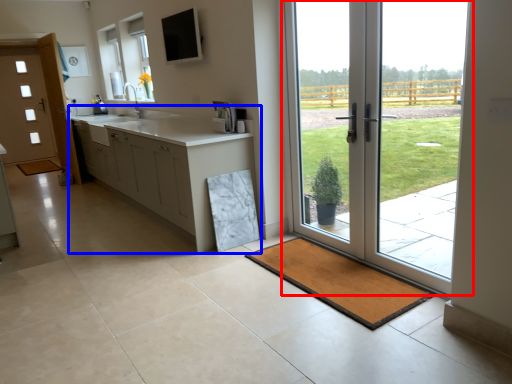
Question: Among these objects, which one is nearest to the camera, door (highlighted by a red box) or cabinetry (highlighted by a blue box)?

Choices:
 (A) door
 (B) cabinetry

Answer: (A)